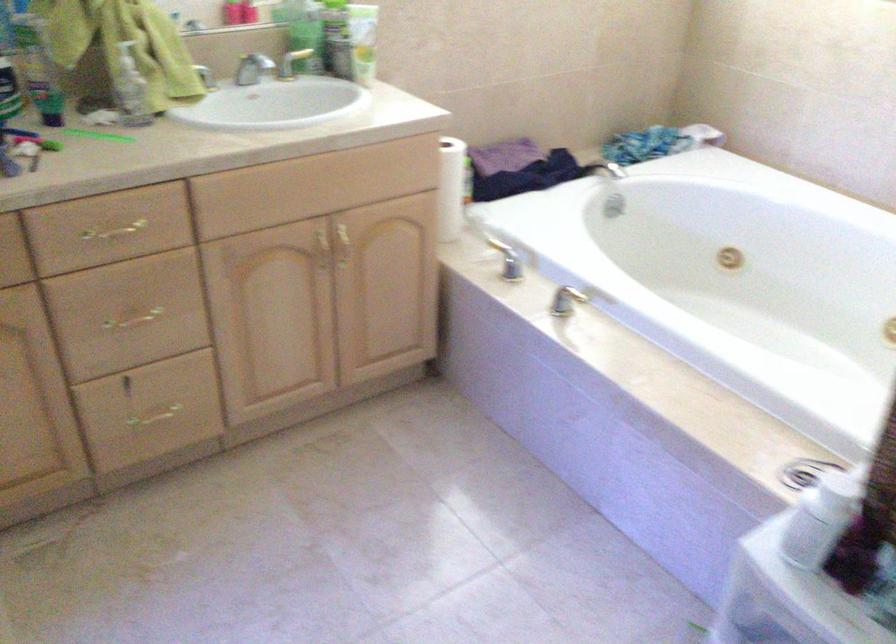
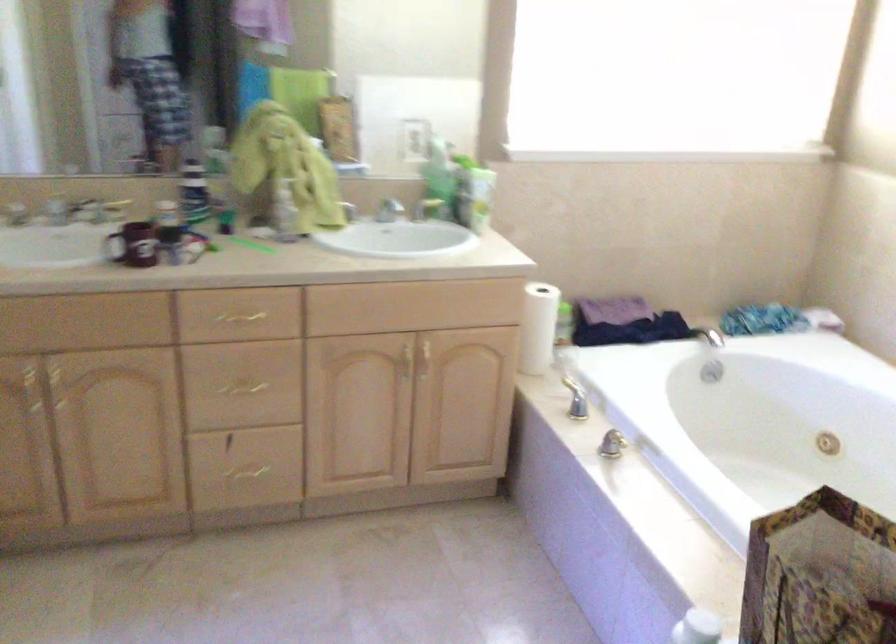
In the second image, find the point that corresponds to point 736,263 in the first image.

(828, 444)